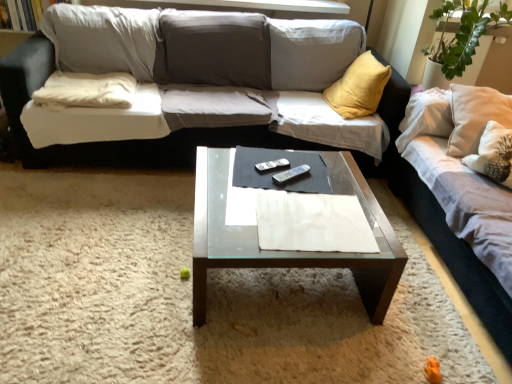
The image size is (512, 384). I want to click on vacant area on the back side of black plastic remote at center, which ranks as the first remote in bottom-to-top order, so click(x=296, y=158).